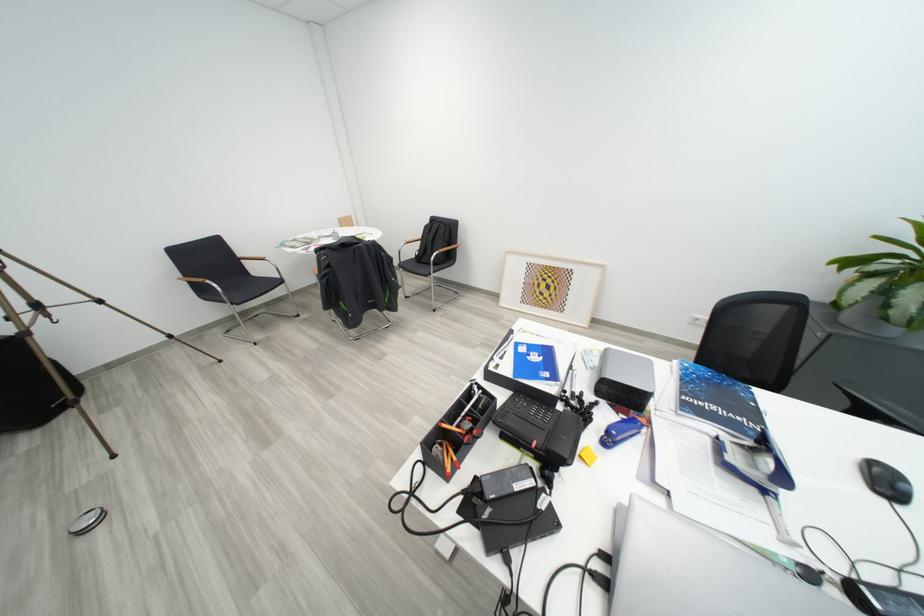
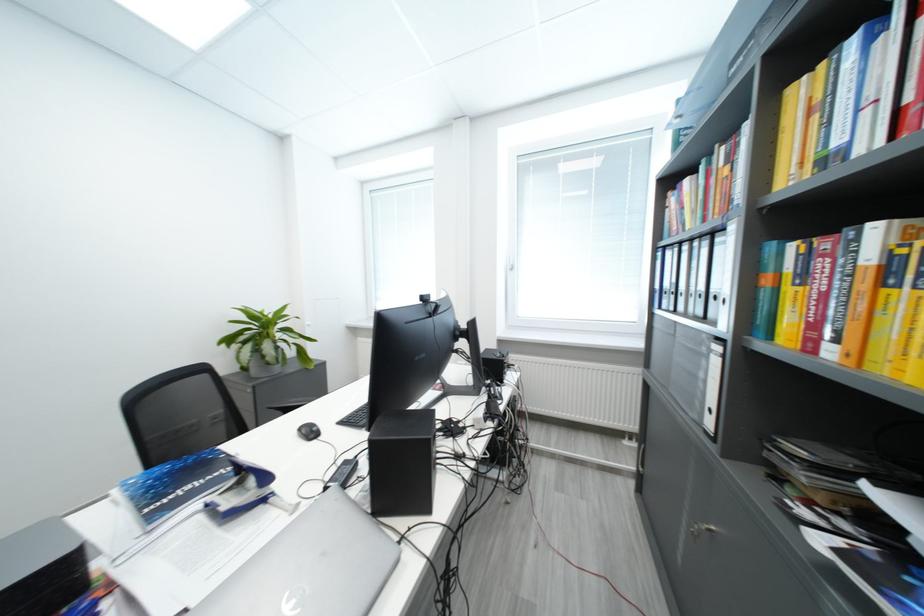
Find the pixel in the second image that matches [884,270] in the first image.

(251, 341)